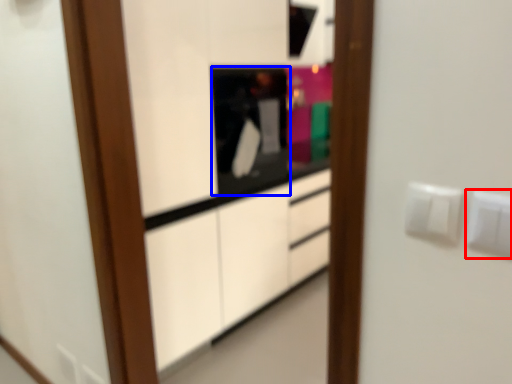
Question: Which object is further to the camera taking this photo, electric outlet (highlighted by a red box) or appliance (highlighted by a blue box)?

Choices:
 (A) electric outlet
 (B) appliance

Answer: (B)